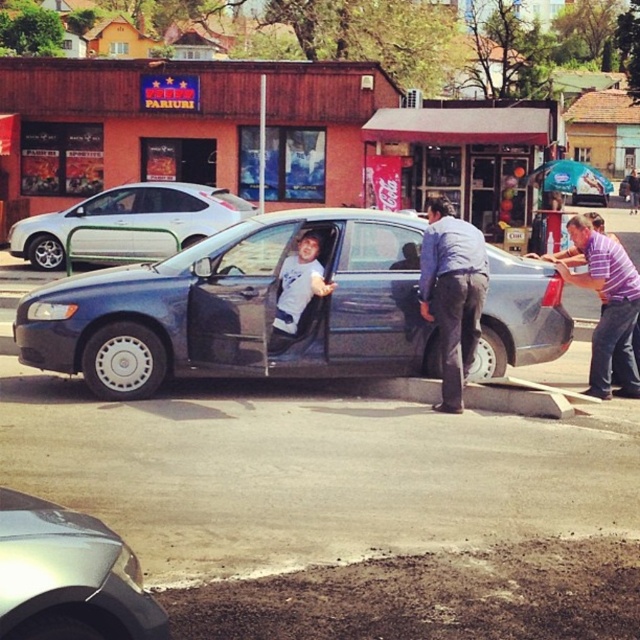
Does silver metallic car at lower left have a greater width compared to blue fabric shirt at center?

Yes.

Between silver metallic car at lower left and blue fabric shirt at center, which one is positioned lower?

silver metallic car at lower left is below.

Does point (81, 608) lie in front of point (444, 305)?

That is True.

Locate an element on the screen. This screenshot has height=640, width=640. silver metallic car at lower left is located at coordinates (68, 577).

Between point (435, 326) and point (301, 241), which one is positioned in front?

Point (301, 241) is more forward.

Image resolution: width=640 pixels, height=640 pixels. What are the coordinates of `metallic blue sedan at center` in the screenshot? It's located at point(240,308).

Image resolution: width=640 pixels, height=640 pixels. Identify the location of metallic blue sedan at center. (240, 308).

Is purple striped shirt at right above white matte shirt at center?

No.

Who is shorter, purple striped shirt at right or white matte shirt at center?

white matte shirt at center

Locate an element on the screen. The width and height of the screenshot is (640, 640). purple striped shirt at right is located at coordinates (605, 305).